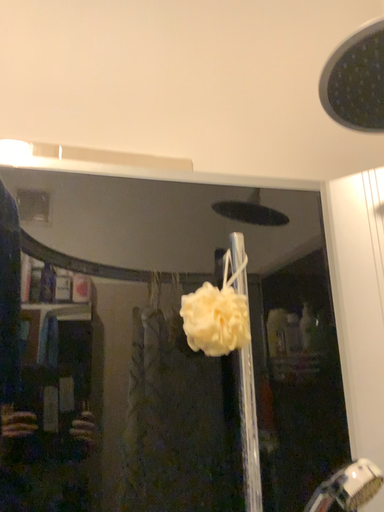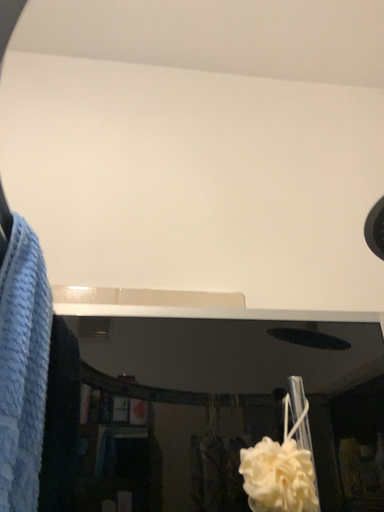
Question: Which way did the camera rotate in the video?

Choices:
 (A) rotated right
 (B) rotated left

Answer: (B)